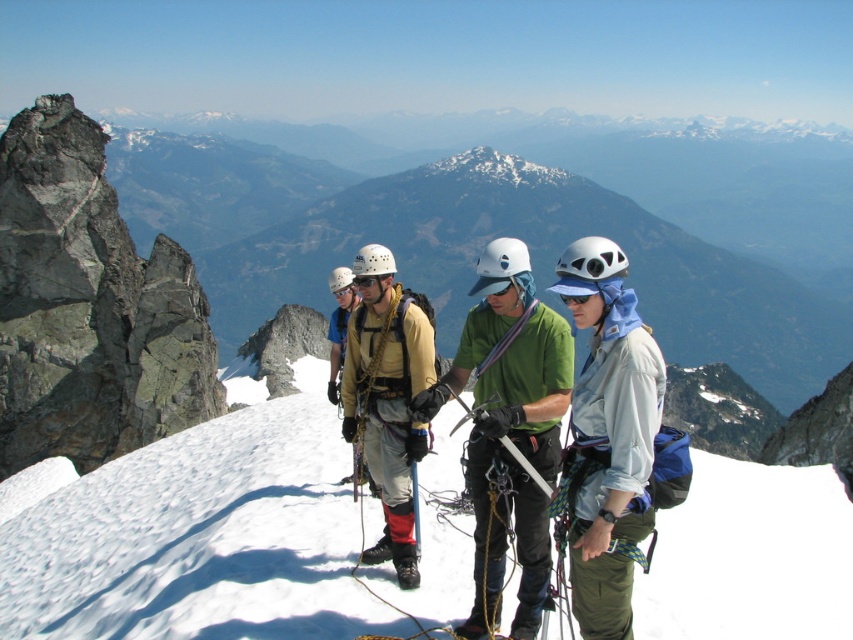
Which is above, light blue fabric jacket at center or blue matte sunglasses at center?

Positioned higher is blue matte sunglasses at center.

Which of these two, light blue fabric jacket at center or blue matte sunglasses at center, stands taller?

light blue fabric jacket at center

Is point (569, 580) farther from viewer compared to point (579, 298)?

Yes, point (569, 580) is farther from viewer.

Where is `light blue fabric jacket at center`? Image resolution: width=853 pixels, height=640 pixels. light blue fabric jacket at center is located at coordinates (608, 436).

From the picture: Between green fabric shirt at center and blue matte sunglasses at center, which one appears on the left side from the viewer's perspective?

Positioned to the left is green fabric shirt at center.

Which is below, green fabric shirt at center or blue matte sunglasses at center?

green fabric shirt at center

Describe the element at coordinates (508, 428) in the screenshot. I see `green fabric shirt at center` at that location.

In order to click on green fabric shirt at center in this screenshot , I will do `click(508, 428)`.

Is green fabric shirt at center bigger than light blue fabric jacket at center?

Yes.

Is point (544, 410) in front of point (648, 515)?

No, (544, 410) is behind (648, 515).

Which is behind, point (505, 323) or point (618, 269)?

Point (505, 323)

In order to click on green fabric shirt at center in this screenshot , I will do `click(508, 428)`.